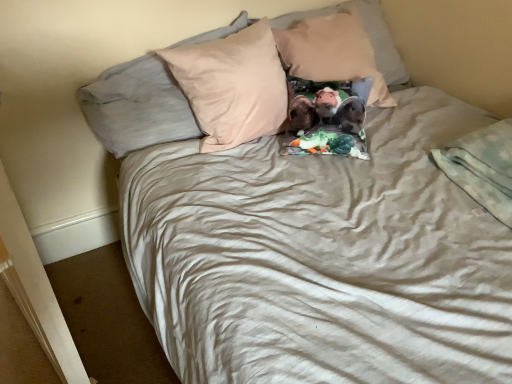
Question: Is light gray soft blanket at lower right completely or partially inside beige fabric pillow at upper center, the 1th pillow positioned from the left?

Choices:
 (A) no
 (B) yes

Answer: (A)

Question: Can you confirm if beige fabric pillow at upper center, the 1th pillow positioned from the left, is shorter than light gray soft blanket at lower right?

Choices:
 (A) no
 (B) yes

Answer: (A)

Question: Is beige fabric pillow at upper center, placed as the third pillow when sorted from right to left, next to light gray soft blanket at lower right?

Choices:
 (A) yes
 (B) no

Answer: (B)

Question: Is the position of beige fabric pillow at upper center, placed as the third pillow when sorted from right to left, more distant than that of light gray soft blanket at lower right?

Choices:
 (A) yes
 (B) no

Answer: (A)

Question: From a real-world perspective, is beige fabric pillow at upper center, the 1th pillow positioned from the left, beneath light gray soft blanket at lower right?

Choices:
 (A) no
 (B) yes

Answer: (A)

Question: Is beige fabric pillow at upper center, placed as the third pillow when sorted from right to left, oriented away from light gray soft blanket at lower right?

Choices:
 (A) no
 (B) yes

Answer: (A)

Question: Is beige fabric pillow at upper center, placed as the third pillow when sorted from right to left, a part of fluffy fabric pillow at center, placed as the 3th pillow when sorted from left to right?

Choices:
 (A) no
 (B) yes

Answer: (A)

Question: From a real-world perspective, is fluffy fabric pillow at center, which is the 1th pillow in right-to-left order, physically below beige fabric pillow at upper center, the 1th pillow positioned from the left?

Choices:
 (A) no
 (B) yes

Answer: (A)

Question: Is fluffy fabric pillow at center, placed as the 3th pillow when sorted from left to right, aimed at beige fabric pillow at upper center, the 1th pillow positioned from the left?

Choices:
 (A) no
 (B) yes

Answer: (A)

Question: From the image's perspective, is fluffy fabric pillow at center, which is the 1th pillow in right-to-left order, beneath beige fabric pillow at upper center, the 1th pillow positioned from the left?

Choices:
 (A) no
 (B) yes

Answer: (A)

Question: Considering the relative sizes of fluffy fabric pillow at center, placed as the 3th pillow when sorted from left to right, and beige fabric pillow at upper center, placed as the third pillow when sorted from right to left, in the image provided, is fluffy fabric pillow at center, placed as the 3th pillow when sorted from left to right, wider than beige fabric pillow at upper center, placed as the third pillow when sorted from right to left,?

Choices:
 (A) yes
 (B) no

Answer: (B)

Question: Is fluffy fabric pillow at center, which is the 1th pillow in right-to-left order, in contact with beige fabric pillow at upper center, placed as the third pillow when sorted from right to left?

Choices:
 (A) no
 (B) yes

Answer: (A)

Question: Is beige cotton pillow at center, which is the second pillow from left to right, positioned behind beige fabric pillow at upper center, placed as the third pillow when sorted from right to left?

Choices:
 (A) yes
 (B) no

Answer: (B)